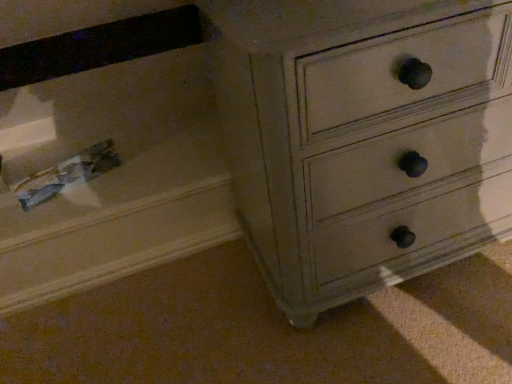
Question: From the image's perspective, is matte white drawer at center, which is the 1th drawer in right-to-left order, located above or below clear plastic drawer at lower left, the first drawer when ordered from left to right?

Choices:
 (A) above
 (B) below

Answer: (A)

Question: Is matte white drawer at center, which is the 1th drawer in right-to-left order, wider or thinner than clear plastic drawer at lower left, the first drawer when ordered from left to right?

Choices:
 (A) wide
 (B) thin

Answer: (B)

Question: Considering the positions of matte white drawer at center, the 2th drawer from the left, and clear plastic drawer at lower left, the first drawer when ordered from left to right, in the image, is matte white drawer at center, the 2th drawer from the left, bigger or smaller than clear plastic drawer at lower left, the first drawer when ordered from left to right,?

Choices:
 (A) small
 (B) big

Answer: (B)

Question: From a real-world perspective, relative to matte white drawer at center, which is the 1th drawer in right-to-left order, is clear plastic drawer at lower left, the first drawer when ordered from left to right, vertically above or below?

Choices:
 (A) below
 (B) above

Answer: (A)

Question: Looking at their shapes, would you say clear plastic drawer at lower left, the first drawer when ordered from left to right, is wider or thinner than matte white drawer at center, the 2th drawer from the left?

Choices:
 (A) thin
 (B) wide

Answer: (B)

Question: From the image's perspective, is clear plastic drawer at lower left, the first drawer when ordered from left to right, positioned above or below matte white drawer at center, which is the 1th drawer in right-to-left order?

Choices:
 (A) above
 (B) below

Answer: (B)

Question: Is point pyautogui.click(x=209, y=165) positioned closer to the camera than point pyautogui.click(x=465, y=170)?

Choices:
 (A) farther
 (B) closer

Answer: (A)